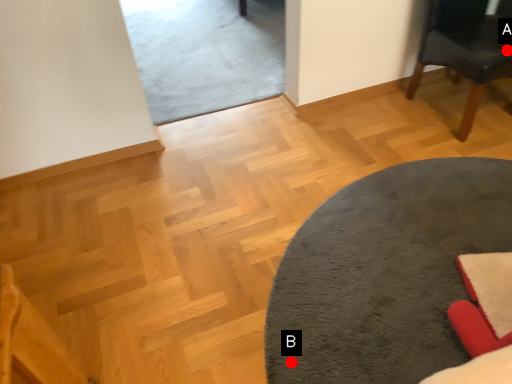
Question: Two points are circled on the image, labeled by A and B beside each circle. Which point is further to the camera?

Choices:
 (A) A is further
 (B) B is further

Answer: (A)